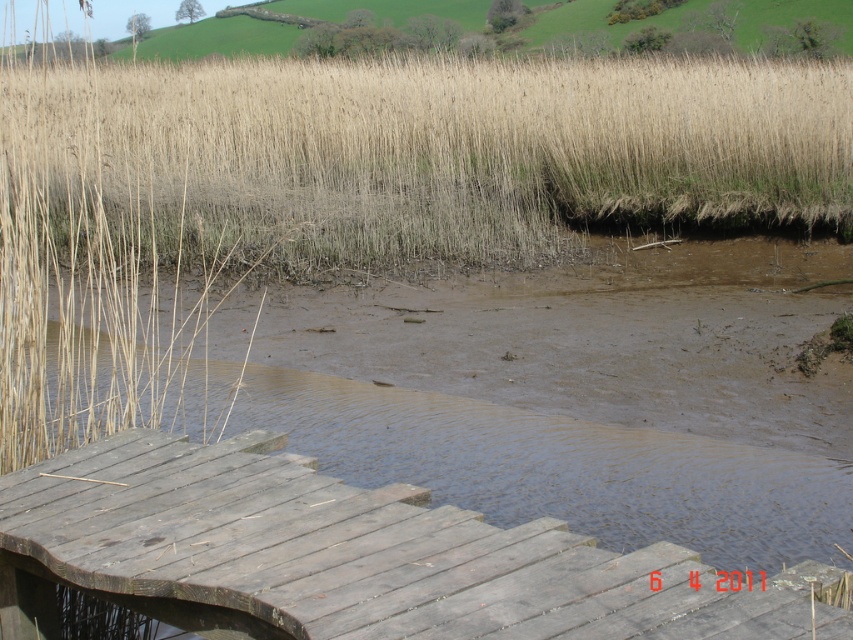
Is point (477, 230) in front of point (70, 476)?

No.

Is dry grass at upper center behind wooden dock at lower left?

Yes, it is.

Describe the element at coordinates (432, 152) in the screenshot. I see `dry grass at upper center` at that location.

This screenshot has height=640, width=853. I want to click on dry grass at upper center, so click(432, 152).